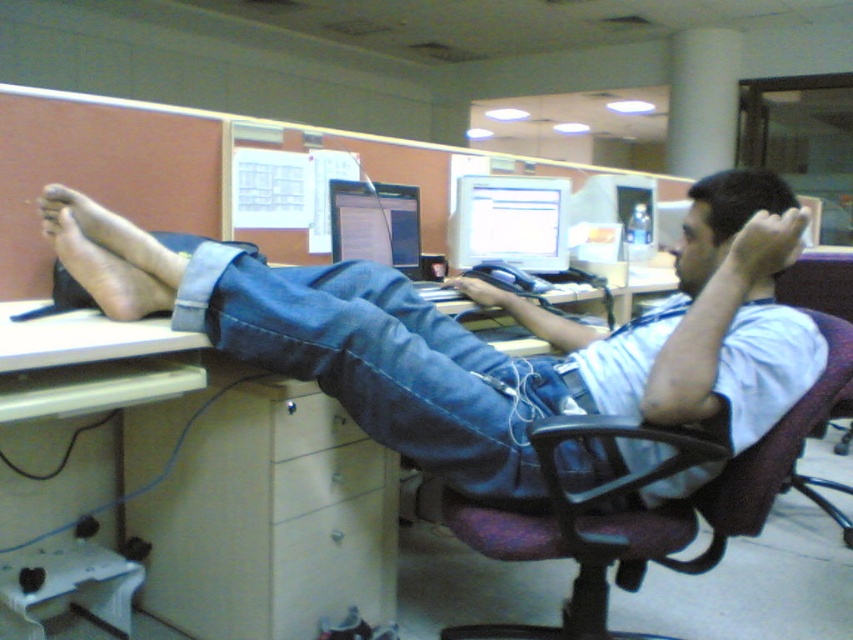
Question: Can you confirm if purple fabric swivel chair at center is positioned to the left of matte black laptop at center?

Choices:
 (A) no
 (B) yes

Answer: (A)

Question: Which point is closer to the camera?

Choices:
 (A) (683, 257)
 (B) (585, 532)

Answer: (B)

Question: Does purple fabric swivel chair at center have a greater width compared to matte black laptop at center?

Choices:
 (A) no
 (B) yes

Answer: (B)

Question: Which object appears farthest from the camera in this image?

Choices:
 (A) matte gray monitor at center
 (B) denim jeans at center
 (C) purple fabric swivel chair at center

Answer: (A)

Question: Which point is closer to the camera taking this photo?

Choices:
 (A) (248, 512)
 (B) (461, 259)

Answer: (A)

Question: Can you confirm if denim at center is positioned below matte gray monitor at center?

Choices:
 (A) no
 (B) yes

Answer: (B)